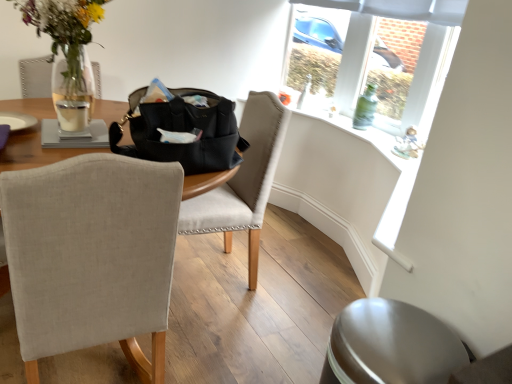
Question: Is black leather handbag at center directly adjacent to green glass bottle at upper right?

Choices:
 (A) yes
 (B) no

Answer: (B)

Question: Would you say black leather handbag at center is outside green glass bottle at upper right?

Choices:
 (A) yes
 (B) no

Answer: (A)

Question: Is black leather handbag at center smaller than green glass bottle at upper right?

Choices:
 (A) yes
 (B) no

Answer: (B)

Question: Is black leather handbag at center far away from green glass bottle at upper right?

Choices:
 (A) no
 (B) yes

Answer: (B)

Question: Can green glass bottle at upper right be found inside black leather handbag at center?

Choices:
 (A) no
 (B) yes

Answer: (A)

Question: In terms of width, does black leather handbag at center look wider or thinner when compared to white matte candle at table left?

Choices:
 (A) wide
 (B) thin

Answer: (A)

Question: Is black leather handbag at center to the left or to the right of white matte candle at table left in the image?

Choices:
 (A) right
 (B) left

Answer: (A)

Question: Is point pos(131,125) closer or farther from the camera than point pos(87,107)?

Choices:
 (A) closer
 (B) farther

Answer: (A)

Question: Would you say black leather handbag at center is inside or outside white matte candle at table left?

Choices:
 (A) inside
 (B) outside

Answer: (B)

Question: Is beige fabric chair at left, the first chair viewed from the front, bigger or smaller than white matte candle at table left?

Choices:
 (A) small
 (B) big

Answer: (B)

Question: Would you say beige fabric chair at left, the first chair viewed from the front, is inside or outside white matte candle at table left?

Choices:
 (A) outside
 (B) inside

Answer: (A)

Question: From a real-world perspective, relative to white matte candle at table left, is beige fabric chair at left, the first chair viewed from the front, vertically above or below?

Choices:
 (A) below
 (B) above

Answer: (A)

Question: Is beige fabric chair at left, the first chair viewed from the front, to the left or to the right of white matte candle at table left in the image?

Choices:
 (A) right
 (B) left

Answer: (A)

Question: Is translucent glass vase with flowers at upper left wider or thinner than white matte candle at table left?

Choices:
 (A) wide
 (B) thin

Answer: (A)

Question: From the image's perspective, is translucent glass vase with flowers at upper left positioned above or below white matte candle at table left?

Choices:
 (A) below
 (B) above

Answer: (B)